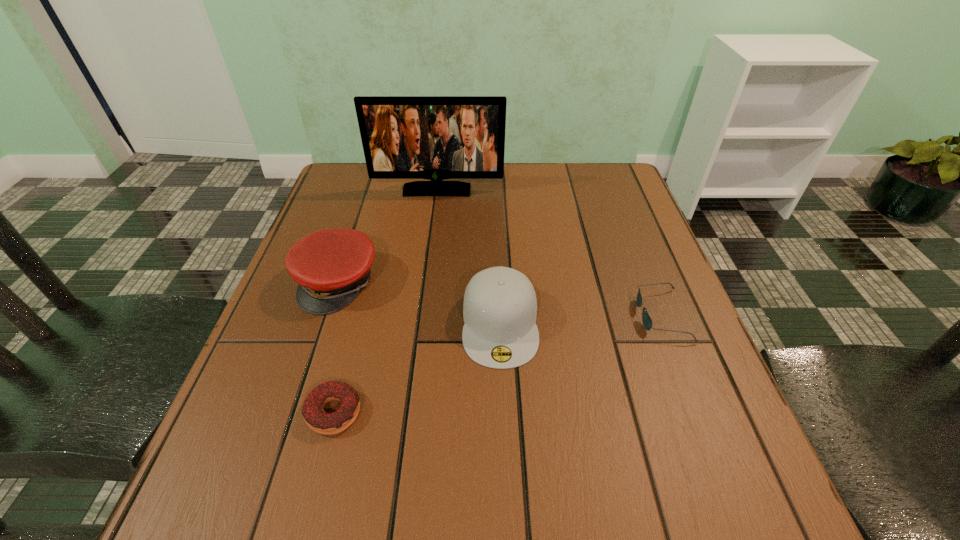
The width and height of the screenshot is (960, 540). I want to click on object that is the third closest one to the doughnut, so click(647, 322).

The image size is (960, 540). What are the coordinates of `object that can be found as the third closest to the rightmost object` in the screenshot? It's located at (316, 418).

I want to click on vacant region that satisfies the following two spatial constraints: 1. on the front of the doughnut with an emblem; 2. on the right side of the left cap, so click(296, 412).